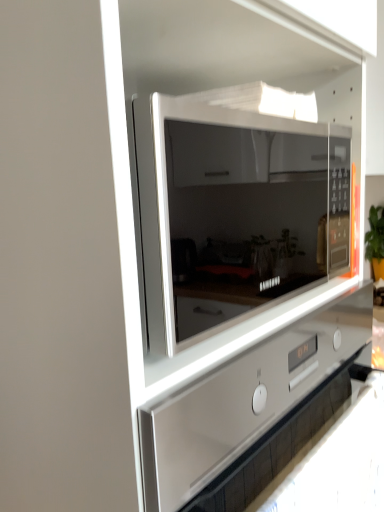
Question: From a real-world perspective, is satin white oven at center located higher than sleek glass microwave at center?

Choices:
 (A) no
 (B) yes

Answer: (A)

Question: Considering the relative sizes of satin white oven at center and sleek glass microwave at center in the image provided, is satin white oven at center taller than sleek glass microwave at center?

Choices:
 (A) no
 (B) yes

Answer: (B)

Question: From the image's perspective, is satin white oven at center beneath sleek glass microwave at center?

Choices:
 (A) yes
 (B) no

Answer: (A)

Question: Considering the relative positions of satin white oven at center and sleek glass microwave at center in the image provided, is satin white oven at center to the right of sleek glass microwave at center from the viewer's perspective?

Choices:
 (A) yes
 (B) no

Answer: (B)

Question: Is satin white oven at center not within sleek glass microwave at center?

Choices:
 (A) no
 (B) yes

Answer: (B)

Question: Is satin white oven at center not close to sleek glass microwave at center?

Choices:
 (A) no
 (B) yes

Answer: (A)

Question: From a real-world perspective, is sleek glass microwave at center beneath satin white oven at center?

Choices:
 (A) no
 (B) yes

Answer: (A)

Question: Considering the relative positions of sleek glass microwave at center and satin white oven at center in the image provided, is sleek glass microwave at center to the left of satin white oven at center from the viewer's perspective?

Choices:
 (A) no
 (B) yes

Answer: (A)

Question: Is sleek glass microwave at center looking in the opposite direction of satin white oven at center?

Choices:
 (A) yes
 (B) no

Answer: (B)

Question: Does sleek glass microwave at center have a larger size compared to satin white oven at center?

Choices:
 (A) no
 (B) yes

Answer: (A)

Question: Does sleek glass microwave at center have a smaller size compared to satin white oven at center?

Choices:
 (A) no
 (B) yes

Answer: (B)

Question: Does sleek glass microwave at center appear on the right side of satin white oven at center?

Choices:
 (A) no
 (B) yes

Answer: (B)

Question: Is satin white oven at center wider or thinner than sleek glass microwave at center?

Choices:
 (A) thin
 (B) wide

Answer: (B)